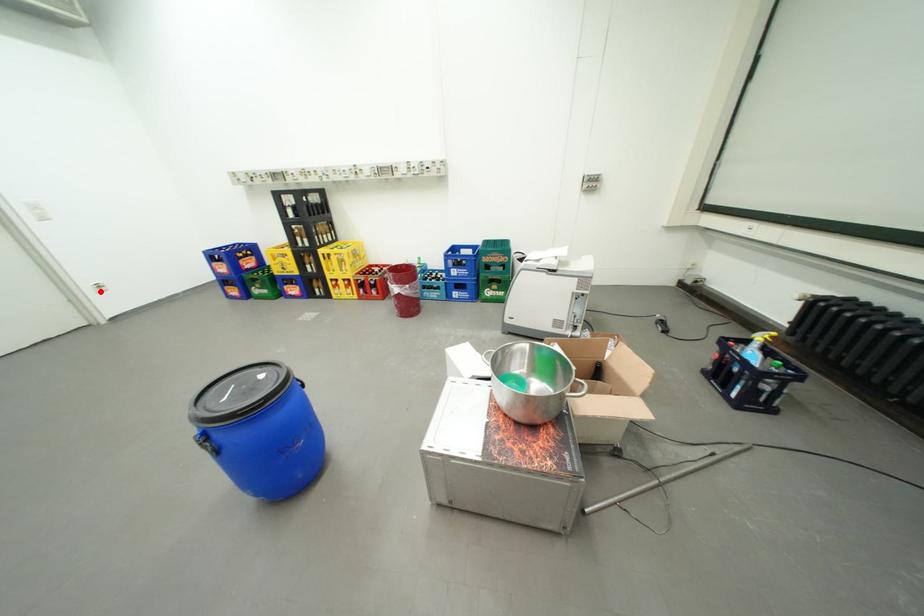
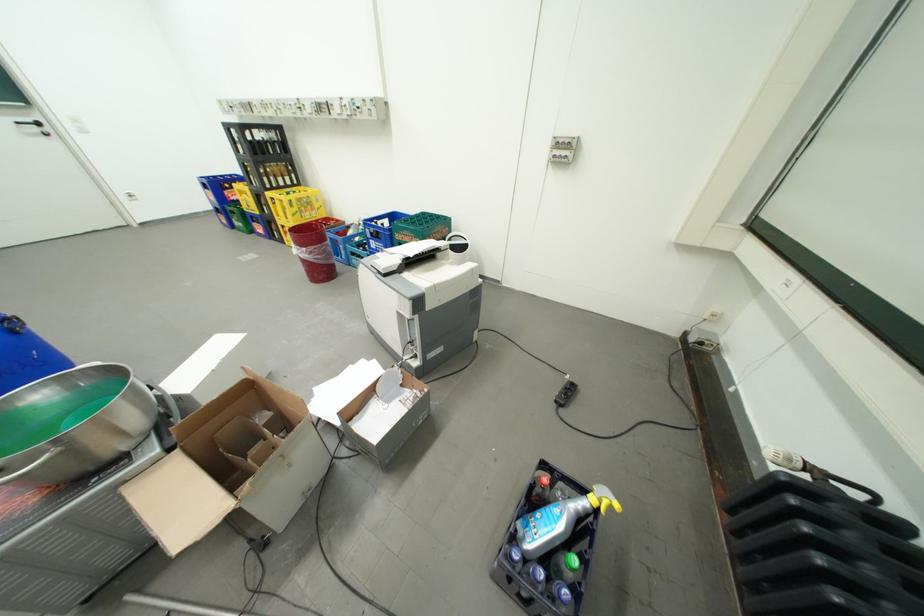
Question: I am providing you with two images of the same scene from different viewpoints. A red point is marked on the first image. Can you still see the location of the red point in image 2?

Choices:
 (A) Yes
 (B) No

Answer: (A)